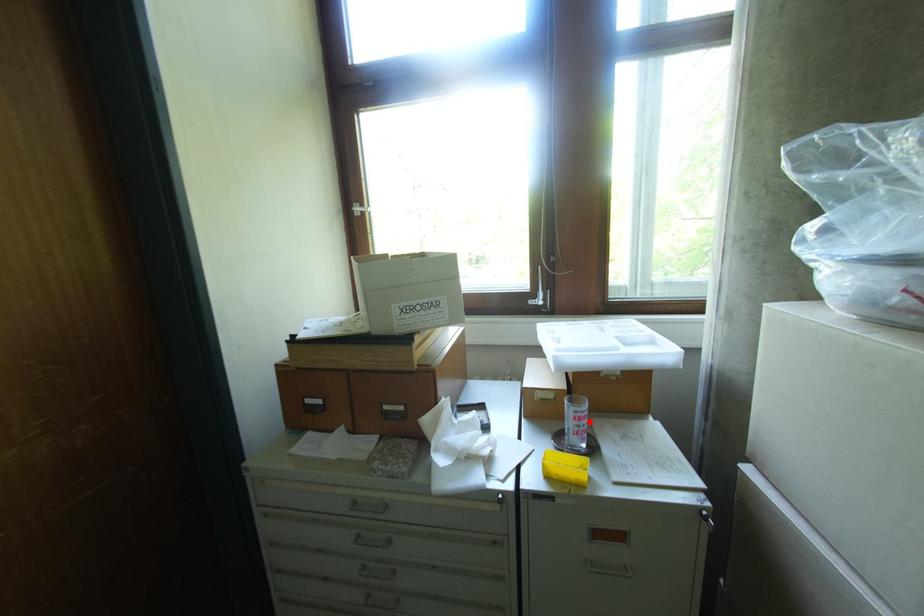
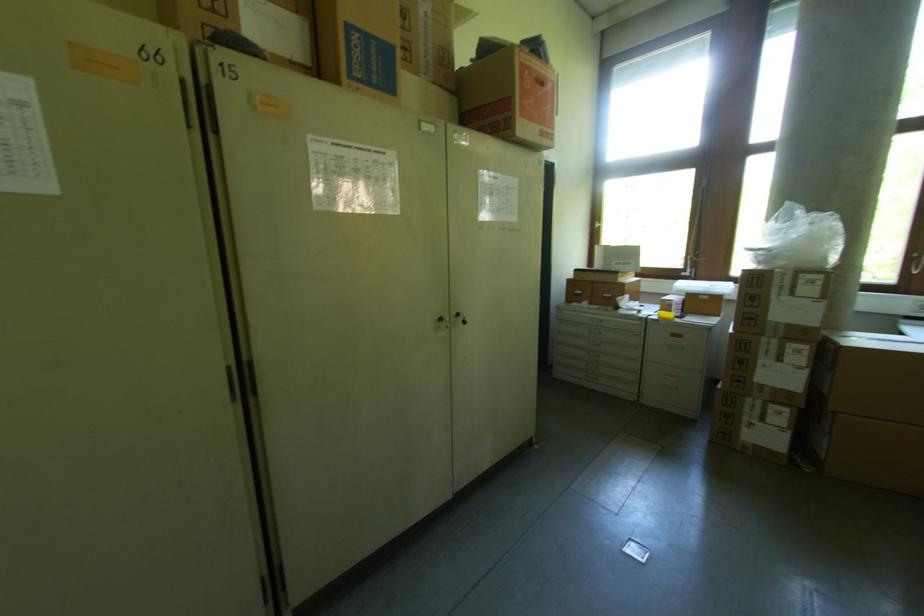
The point at the highlighted location is marked in the first image. Where is the corresponding point in the second image?

(684, 308)